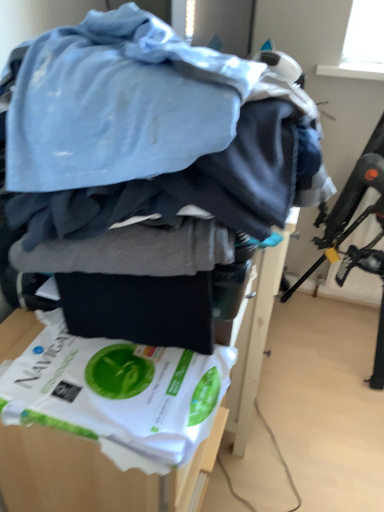
Where is `white paper at lower left`? white paper at lower left is located at coordinates (118, 393).

The width and height of the screenshot is (384, 512). What do you see at coordinates (356, 227) in the screenshot?
I see `black plastic swivel chair at upper right` at bounding box center [356, 227].

At what (x,y) coordinates should I click in order to perform the action: click on white paper bag at center. Please return your answer as a coordinate pair (x, y). Looking at the image, I should click on (94, 474).

From a real-world perspective, is white paper at lower left located higher than black plastic swivel chair at upper right?

Indeed, from a real-world perspective, white paper at lower left stands above black plastic swivel chair at upper right.

Does white paper at lower left appear on the left side of black plastic swivel chair at upper right?

Correct, you'll find white paper at lower left to the left of black plastic swivel chair at upper right.

Does point (158, 446) come behind point (345, 215)?

That is False.

Considering the relative positions of white paper at lower left and black plastic swivel chair at upper right in the image provided, is white paper at lower left behind black plastic swivel chair at upper right?

That is False.

What's the angular difference between black plastic swivel chair at upper right and white paper bag at center's facing directions?

The angular difference between black plastic swivel chair at upper right and white paper bag at center is 88.2 degrees.

From the image's perspective, which is above, black plastic swivel chair at upper right or white paper bag at center?

black plastic swivel chair at upper right appears higher in the image.

Considering the sizes of objects black plastic swivel chair at upper right and white paper bag at center in the image provided, who is smaller, black plastic swivel chair at upper right or white paper bag at center?

white paper bag at center is smaller.

Who is shorter, white paper bag at center or white paper at lower left?

With less height is white paper at lower left.

Does white paper bag at center come behind white paper at lower left?

Yes, white paper bag at center is behind white paper at lower left.

Which object is thinner, white paper bag at center or white paper at lower left?

white paper at lower left is thinner.

From the image's perspective, which one is positioned higher, white paper bag at center or white paper at lower left?

→ white paper at lower left appears higher in the image.

Based on the photo, from the image's perspective, is black plastic swivel chair at upper right above or below white paper at lower left?

Based on their image positions, black plastic swivel chair at upper right is located above white paper at lower left.

Can you tell me how much black plastic swivel chair at upper right and white paper at lower left differ in facing direction?

The angular difference between black plastic swivel chair at upper right and white paper at lower left is 88.7 degrees.

Looking at the image, does black plastic swivel chair at upper right seem bigger or smaller compared to white paper at lower left?

Clearly, black plastic swivel chair at upper right is larger in size than white paper at lower left.

From a real-world perspective, is black plastic swivel chair at upper right on white paper at lower left?

Incorrect, from a real-world perspective, black plastic swivel chair at upper right is lower than white paper at lower left.

Between point (132, 424) and point (213, 443), which one is positioned behind?

The point (213, 443) is farther.

Between white paper at lower left and white paper bag at center, which one has more height?

Standing taller between the two is white paper bag at center.

Consider the image. Considering the relative sizes of white paper at lower left and white paper bag at center in the image provided, is white paper at lower left bigger than white paper bag at center?

Incorrect, white paper at lower left is not larger than white paper bag at center.

From a real-world perspective, which is physically above, white paper at lower left or white paper bag at center?

From a 3D spatial view, white paper at lower left is above.

Who is bigger, white paper bag at center or black plastic swivel chair at upper right?

Bigger between the two is black plastic swivel chair at upper right.

This screenshot has height=512, width=384. What are the coordinates of `swivel chair located on the right of white paper bag at center` in the screenshot? It's located at (356, 227).

From a real-world perspective, is white paper bag at center below black plastic swivel chair at upper right?

Yes.

Would you say white paper bag at center is a long distance from black plastic swivel chair at upper right?

Yes, white paper bag at center is far from black plastic swivel chair at upper right.

Identify the location of swivel chair that appears on the right of white paper at lower left. pos(356,227).

Find the location of a particular element. furniture located below the black plastic swivel chair at upper right (from the image's perspective) is located at coordinates (94, 474).

Estimate the real-world distances between objects in this image. Which object is closer to white paper at lower left, white paper bag at center or black plastic swivel chair at upper right?

white paper bag at center is closer to white paper at lower left.

Estimate the real-world distances between objects in this image. Which object is closer to black plastic swivel chair at upper right, white paper at lower left or white paper bag at center?

white paper bag at center lies closer to black plastic swivel chair at upper right than the other object.

Based on the photo, estimate the real-world distances between objects in this image. Which object is closer to white paper bag at center, black plastic swivel chair at upper right or white paper at lower left?

white paper at lower left is positioned closer to the anchor white paper bag at center.

Consider the image. From the image, which object appears to be nearer to black plastic swivel chair at upper right, white paper bag at center or white paper at lower left?

white paper bag at center.

Considering their positions, is black plastic swivel chair at upper right positioned further to white paper at lower left than white paper bag at center?

black plastic swivel chair at upper right.

Considering their positions, is white paper at lower left positioned closer to white paper bag at center than black plastic swivel chair at upper right?

white paper at lower left lies closer to white paper bag at center than the other object.

Find the location of `waste between white paper bag at center and black plastic swivel chair at upper right from left to right`. waste between white paper bag at center and black plastic swivel chair at upper right from left to right is located at coordinates (118, 393).